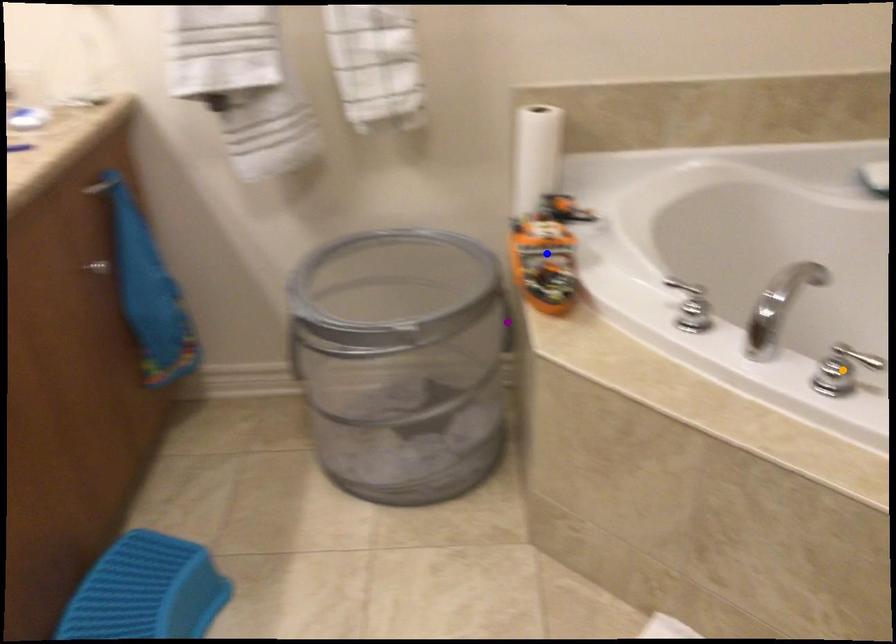
Order these from farthest to nearest:
blue point | orange point | purple point

purple point → blue point → orange point